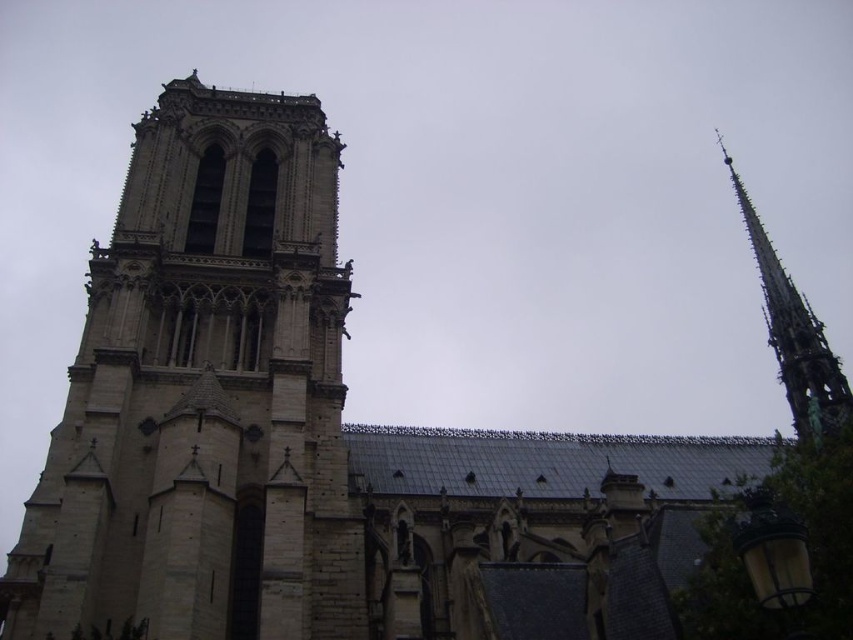
Consider the image. Is stone tower at left positioned behind green copper spire at upper right?

No, it is in front of green copper spire at upper right.

Is stone tower at left below green copper spire at upper right?

Indeed, stone tower at left is positioned under green copper spire at upper right.

Does point (165, 292) come closer to viewer compared to point (801, 406)?

Yes, it is in front of point (801, 406).

Find the location of a particular element. The width and height of the screenshot is (853, 640). stone tower at left is located at coordinates (204, 394).